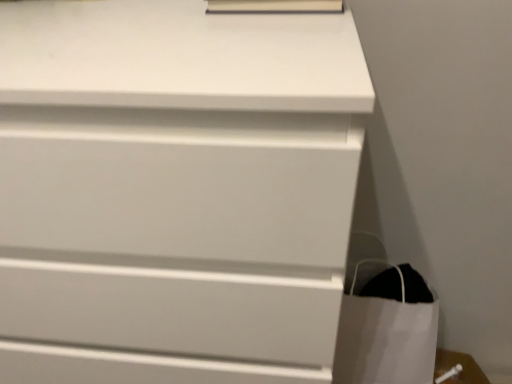
Question: Is matte white book at upper center oriented towards white matte chest of drawers at center?

Choices:
 (A) no
 (B) yes

Answer: (A)

Question: Is matte white book at upper center next to white matte chest of drawers at center?

Choices:
 (A) no
 (B) yes

Answer: (A)

Question: Is matte white book at upper center further to camera compared to white matte chest of drawers at center?

Choices:
 (A) yes
 (B) no

Answer: (A)

Question: Does matte white book at upper center appear on the right side of white matte chest of drawers at center?

Choices:
 (A) no
 (B) yes

Answer: (B)

Question: Is the depth of matte white book at upper center less than that of white matte chest of drawers at center?

Choices:
 (A) yes
 (B) no

Answer: (B)

Question: From the image's perspective, is matte white book at upper center positioned above or below white matte chest of drawers at center?

Choices:
 (A) below
 (B) above

Answer: (B)

Question: Relative to white matte chest of drawers at center, is matte white book at upper center in front or behind?

Choices:
 (A) front
 (B) behind

Answer: (B)

Question: In terms of height, does matte white book at upper center look taller or shorter compared to white matte chest of drawers at center?

Choices:
 (A) tall
 (B) short

Answer: (B)

Question: From a real-world perspective, is matte white book at upper center above or below white matte chest of drawers at center?

Choices:
 (A) above
 (B) below

Answer: (A)

Question: In the image, is matte white book at upper center positioned in front of or behind white paper bag at lower right?

Choices:
 (A) front
 (B) behind

Answer: (A)

Question: Considering the relative positions of matte white book at upper center and white paper bag at lower right in the image provided, is matte white book at upper center to the left or to the right of white paper bag at lower right?

Choices:
 (A) right
 (B) left

Answer: (B)

Question: In terms of width, does matte white book at upper center look wider or thinner when compared to white paper bag at lower right?

Choices:
 (A) wide
 (B) thin

Answer: (B)

Question: From their relative heights in the image, would you say matte white book at upper center is taller or shorter than white paper bag at lower right?

Choices:
 (A) short
 (B) tall

Answer: (A)

Question: Is white paper bag at lower right to the left or to the right of matte white book at upper center in the image?

Choices:
 (A) right
 (B) left

Answer: (A)

Question: Which is correct: white paper bag at lower right is inside matte white book at upper center, or outside of it?

Choices:
 (A) outside
 (B) inside

Answer: (A)